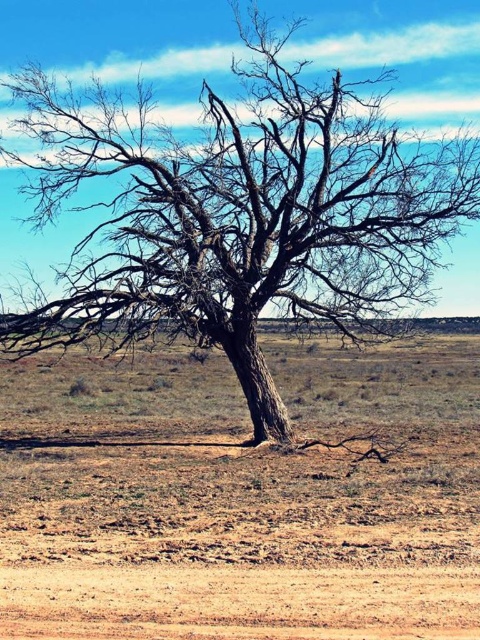
You are a hiker carrying a 2 meter long ladder. You need to place the ladder between the brown sandy soil at center and the dark brown bark tree at center. Can you fit the ladder horizontally between them?

The distance between the brown sandy soil at center and the dark brown bark tree at center is 5.63 meters, so the ladder is only 2 meters long. Therefore, the ladder can be placed horizontally between them as there is enough space.

You are a hiker trying to determine the elevation differences in the area. Based on the image, which object has a lower elevation between the brown sandy soil at center and the dark brown bark tree at center?

The brown sandy soil at center has a lesser height compared to the dark brown bark tree at center, so the brown sandy soil at center is at a lower elevation.

You are standing at the base of the solitary tree in the desert landscape. You notice two points marked on the ground. One is at coordinates point (197,524) and the other at point (231,291). If you face the direction the tree is leaning, which point is closer to you?

Point (197,524) is in front of point (231,291), so if you face the direction the tree is leaning, the point closer to you would be point (197,524).